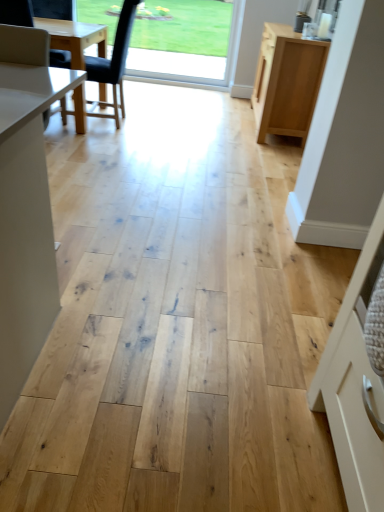
Question: Does point (94, 71) appear closer or farther from the camera than point (203, 0)?

Choices:
 (A) closer
 (B) farther

Answer: (A)

Question: Considering the positions of black leather chair at left and transparent glass window at upper center in the image, is black leather chair at left bigger or smaller than transparent glass window at upper center?

Choices:
 (A) big
 (B) small

Answer: (A)

Question: Which object is the closest to the black leather chair at left?

Choices:
 (A) transparent glass window at upper center
 (B) light wood cabinet at right

Answer: (A)

Question: Based on their relative distances, which object is nearer to the transparent glass window at upper center?

Choices:
 (A) black leather chair at left
 (B) light wood cabinet at right

Answer: (A)